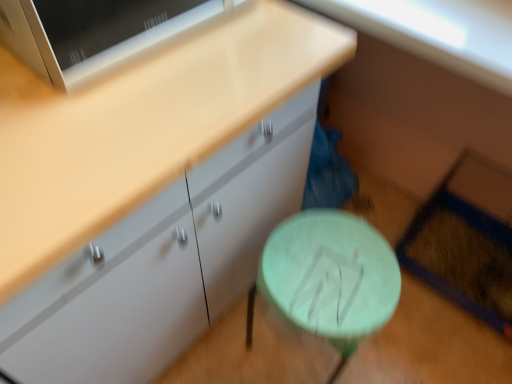
The image size is (512, 384). In order to click on vacant region above matte white cabinet at center (from a real-world perspective) in this screenshot , I will do `click(132, 85)`.